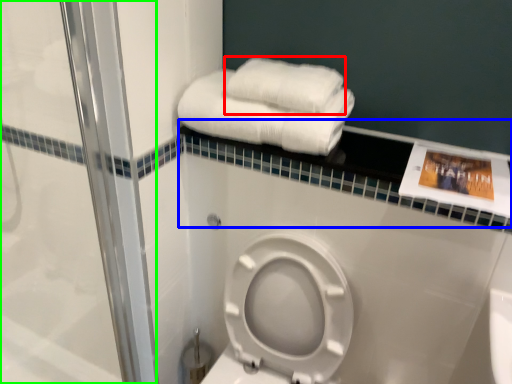
Question: Based on their relative distances, which object is nearer to towel (highlighted by a red box)? Choose from balustrade (highlighted by a blue box) and shower door (highlighted by a green box).

Choices:
 (A) balustrade
 (B) shower door

Answer: (A)